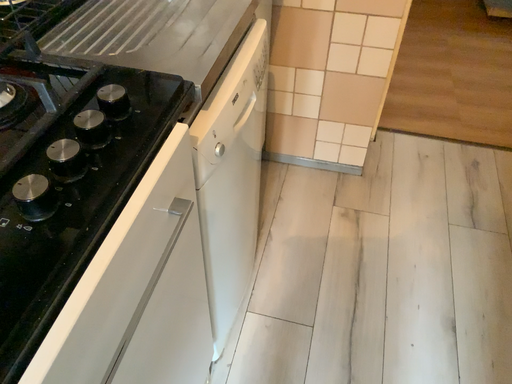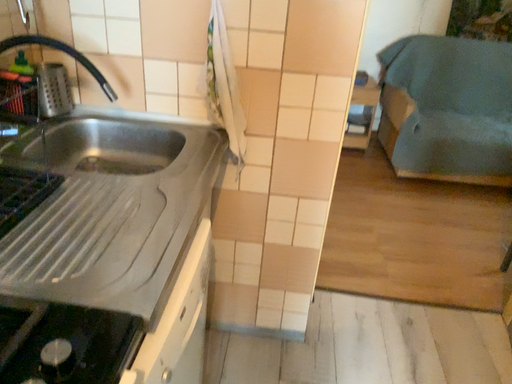
Question: How did the camera likely rotate when shooting the video?

Choices:
 (A) rotated upward
 (B) rotated downward

Answer: (A)